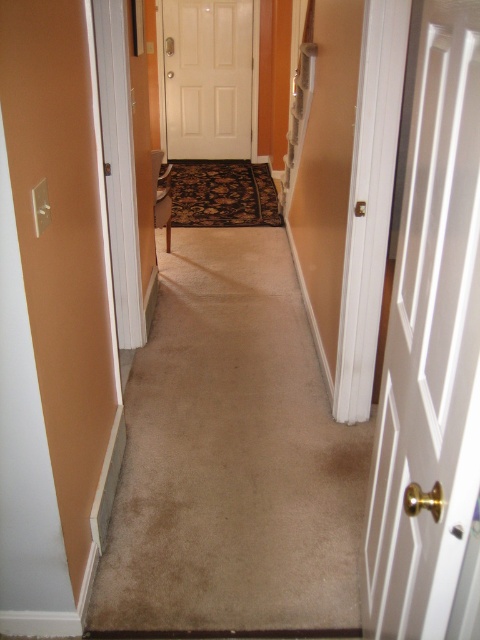
You are moving a large painting that is 1.2 meters wide. You need to pass through the hallway and go through one of the doors. Which door between the white wood door at right and the white matte door at center can the painting fit through?

The white matte door at center is larger than the white wood door at right, so the painting can fit through the white matte door at center.

You are standing in the hallway and need to exit through the door. The white wood door at right and the white matte door at center are both in front of you. Which door is positioned to the right side of the other?

The white wood door at right is positioned to the right of the white matte door at center.

You are standing at the entrance of the hallway and want to reach the white wood door at right. Based on the image, what is the direction you should move towards to reach the door?

The white wood door at right is located at the far end of the hallway, so you should move forward along the hallway to reach it.